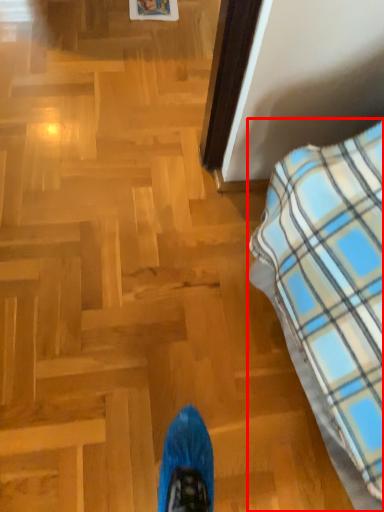
Question: From the image's perspective, what is the correct spatial positioning of furniture (annotated by the red box) in reference to picture frame?

Choices:
 (A) above
 (B) below

Answer: (B)